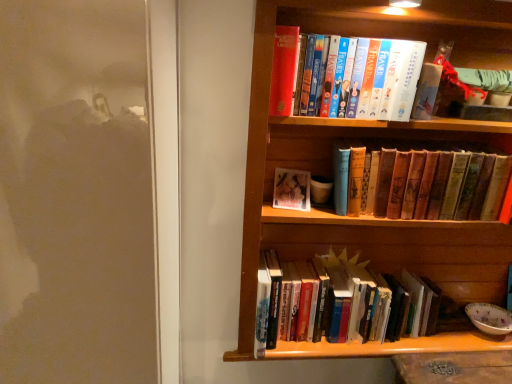
Locate an element on the screen. This screenshot has width=512, height=384. hardcover books at center, acting as the first book starting from the bottom is located at coordinates (350, 318).

In order to click on hardcover book at upper center, the 1th book in the top-to-bottom sequence in this screenshot , I will do `click(386, 78)`.

How many degrees apart are the facing directions of vintage leather book at center, positioned as the 2th book in bottom-to-top order, and hardcover books at center, which is counted as the third book, starting from the top?

The facing directions of vintage leather book at center, positioned as the 2th book in bottom-to-top order, and hardcover books at center, which is counted as the third book, starting from the top, are 0.00279 degrees apart.

Considering the sizes of objects vintage leather book at center, acting as the 2th book starting from the top, and hardcover books at center, which is counted as the third book, starting from the top, in the image provided, who is bigger, vintage leather book at center, acting as the 2th book starting from the top, or hardcover books at center, which is counted as the third book, starting from the top,?

With larger size is hardcover books at center, which is counted as the third book, starting from the top.

Is vintage leather book at center, positioned as the 2th book in bottom-to-top order, taller or shorter than hardcover books at center, which is counted as the third book, starting from the top?

Clearly, vintage leather book at center, positioned as the 2th book in bottom-to-top order, is shorter compared to hardcover books at center, which is counted as the third book, starting from the top.

Is hardcover books at center, which is counted as the third book, starting from the top, at the back of vintage leather book at center, positioned as the 2th book in bottom-to-top order?

No.

Would you say wooden bookcase at upper right is a long distance from hardcover book at upper center, the 1th book in the top-to-bottom sequence?

No, there isn't a large distance between wooden bookcase at upper right and hardcover book at upper center, the 1th book in the top-to-bottom sequence.

From the image's perspective, which is below, wooden bookcase at upper right or hardcover book at upper center, the 1th book in the top-to-bottom sequence?

wooden bookcase at upper right.

Is wooden bookcase at upper right in front of or behind hardcover book at upper center, the 1th book in the top-to-bottom sequence, in the image?

Clearly, wooden bookcase at upper right is in front of hardcover book at upper center, the 1th book in the top-to-bottom sequence.

Is point (466, 286) positioned behind point (345, 65)?

Yes, point (466, 286) is behind point (345, 65).

From a real-world perspective, who is located lower, wooden bookcase at upper right or hardcover books at center, acting as the first book starting from the bottom?

hardcover books at center, acting as the first book starting from the bottom, from a real-world perspective.

Between wooden bookcase at upper right and hardcover books at center, acting as the first book starting from the bottom, which one has larger size?

Bigger between the two is wooden bookcase at upper right.

Is wooden bookcase at upper right in front of hardcover books at center, which is counted as the third book, starting from the top?

Yes, wooden bookcase at upper right is closer to the viewer.

In the scene shown: Would you say wooden bookcase at upper right contains hardcover books at center, acting as the first book starting from the bottom?

Yes.

Are hardcover book at upper center, which is counted as the third book, starting from the bottom, and vintage leather book at center, positioned as the 2th book in bottom-to-top order, beside each other?

No.

Is hardcover book at upper center, which is counted as the third book, starting from the bottom, spatially inside vintage leather book at center, positioned as the 2th book in bottom-to-top order, or outside of it?

hardcover book at upper center, which is counted as the third book, starting from the bottom, cannot be found inside vintage leather book at center, positioned as the 2th book in bottom-to-top order.

Is hardcover book at upper center, the 1th book in the top-to-bottom sequence, in front of vintage leather book at center, positioned as the 2th book in bottom-to-top order?

Yes, it is.

Between hardcover book at upper center, which is counted as the third book, starting from the bottom, and vintage leather book at center, acting as the 2th book starting from the top, which one appears on the left side from the viewer's perspective?

Positioned to the left is hardcover book at upper center, which is counted as the third book, starting from the bottom.

From a real-world perspective, between hardcover book at upper center, which is counted as the third book, starting from the bottom, and wooden bookcase at upper right, who is vertically lower?

wooden bookcase at upper right is physically lower.

Does point (399, 55) lie in front of point (312, 121)?

Yes, it is in front of point (312, 121).

Considering the relative sizes of hardcover book at upper center, which is counted as the third book, starting from the bottom, and wooden bookcase at upper right in the image provided, is hardcover book at upper center, which is counted as the third book, starting from the bottom, smaller than wooden bookcase at upper right?

Correct, hardcover book at upper center, which is counted as the third book, starting from the bottom, occupies less space than wooden bookcase at upper right.

Considering the relative positions of hardcover book at upper center, which is counted as the third book, starting from the bottom, and wooden bookcase at upper right in the image provided, is hardcover book at upper center, which is counted as the third book, starting from the bottom, in front of wooden bookcase at upper right?

No.

Based on the photo, are hardcover books at center, acting as the first book starting from the bottom, and wooden bookcase at upper right beside each other?

No, hardcover books at center, acting as the first book starting from the bottom, is not beside wooden bookcase at upper right.

How many degrees apart are the facing directions of hardcover books at center, acting as the first book starting from the bottom, and wooden bookcase at upper right?

0.000686 degrees separate the facing orientations of hardcover books at center, acting as the first book starting from the bottom, and wooden bookcase at upper right.

Which of these two, hardcover books at center, which is counted as the third book, starting from the top, or wooden bookcase at upper right, stands shorter?

Standing shorter between the two is hardcover books at center, which is counted as the third book, starting from the top.

From a real-world perspective, relative to wooden bookcase at upper right, is hardcover books at center, which is counted as the third book, starting from the top, vertically above or below?

→ hardcover books at center, which is counted as the third book, starting from the top, is below wooden bookcase at upper right.

Is vintage leather book at center, positioned as the 2th book in bottom-to-top order, not near hardcover book at upper center, which is counted as the third book, starting from the bottom?

They are positioned close to each other.

From a real-world perspective, between vintage leather book at center, acting as the 2th book starting from the top, and hardcover book at upper center, the 1th book in the top-to-bottom sequence, who is vertically lower?

vintage leather book at center, acting as the 2th book starting from the top, from a real-world perspective.

From the image's perspective, which one is positioned lower, vintage leather book at center, acting as the 2th book starting from the top, or hardcover book at upper center, the 1th book in the top-to-bottom sequence?

From the image's view, vintage leather book at center, acting as the 2th book starting from the top, is below.

Can you confirm if vintage leather book at center, positioned as the 2th book in bottom-to-top order, is shorter than hardcover book at upper center, which is counted as the third book, starting from the bottom?

Yes.

Where is `book that is the 1st one above the hardcover books at center, which is counted as the third book, starting from the top (from a real-world perspective)`? This screenshot has width=512, height=384. book that is the 1st one above the hardcover books at center, which is counted as the third book, starting from the top (from a real-world perspective) is located at coordinates (421, 183).

This screenshot has height=384, width=512. What are the coordinates of `the 2nd book to the left of the wooden bookcase at upper right, counting from the anchor's position` in the screenshot? It's located at (386, 78).

Looking at the image, which one is located closer to hardcover book at upper center, which is counted as the third book, starting from the bottom, hardcover books at center, which is counted as the third book, starting from the top, or vintage leather book at center, positioned as the 2th book in bottom-to-top order?

The object closer to hardcover book at upper center, which is counted as the third book, starting from the bottom, is vintage leather book at center, positioned as the 2th book in bottom-to-top order.

Looking at the image, which one is located further to hardcover books at center, acting as the first book starting from the bottom, wooden bookcase at upper right or hardcover book at upper center, which is counted as the third book, starting from the bottom?

Based on the image, hardcover book at upper center, which is counted as the third book, starting from the bottom, appears to be further to hardcover books at center, acting as the first book starting from the bottom.

When comparing their distances from wooden bookcase at upper right, does vintage leather book at center, positioned as the 2th book in bottom-to-top order, or hardcover books at center, which is counted as the third book, starting from the top, seem further?

The object further to wooden bookcase at upper right is hardcover books at center, which is counted as the third book, starting from the top.

Looking at the image, which one is located further to vintage leather book at center, acting as the 2th book starting from the top, hardcover books at center, acting as the first book starting from the bottom, or wooden bookcase at upper right?

The object further to vintage leather book at center, acting as the 2th book starting from the top, is hardcover books at center, acting as the first book starting from the bottom.

From the picture: Estimate the real-world distances between objects in this image. Which object is further from hardcover book at upper center, which is counted as the third book, starting from the bottom, vintage leather book at center, positioned as the 2th book in bottom-to-top order, or wooden bookcase at upper right?

Based on the image, wooden bookcase at upper right appears to be further to hardcover book at upper center, which is counted as the third book, starting from the bottom.

Which object lies further to the anchor point hardcover books at center, acting as the first book starting from the bottom, hardcover book at upper center, the 1th book in the top-to-bottom sequence, or vintage leather book at center, acting as the 2th book starting from the top?

hardcover book at upper center, the 1th book in the top-to-bottom sequence, is positioned further to the anchor hardcover books at center, acting as the first book starting from the bottom.

From the image, which object appears to be nearer to wooden bookcase at upper right, hardcover books at center, which is counted as the third book, starting from the top, or vintage leather book at center, acting as the 2th book starting from the top?

vintage leather book at center, acting as the 2th book starting from the top.

Based on their spatial positions, is hardcover book at upper center, the 1th book in the top-to-bottom sequence, or vintage leather book at center, positioned as the 2th book in bottom-to-top order, closer to wooden bookcase at upper right?

Among the two, vintage leather book at center, positioned as the 2th book in bottom-to-top order, is located nearer to wooden bookcase at upper right.

This screenshot has height=384, width=512. Identify the location of book between hardcover book at upper center, the 1th book in the top-to-bottom sequence, and wooden bookcase at upper right vertically. (421, 183).

Image resolution: width=512 pixels, height=384 pixels. In order to click on book between hardcover book at upper center, which is counted as the third book, starting from the bottom, and hardcover books at center, acting as the first book starting from the bottom, in the vertical direction in this screenshot , I will do `click(421, 183)`.

The height and width of the screenshot is (384, 512). Identify the location of bookcase between vintage leather book at center, acting as the 2th book starting from the top, and hardcover books at center, acting as the first book starting from the bottom, in the up-down direction. (366, 136).

At what (x,y) coordinates should I click in order to perform the action: click on bookcase between hardcover book at upper center, which is counted as the third book, starting from the bottom, and hardcover books at center, which is counted as the third book, starting from the top, vertically. Please return your answer as a coordinate pair (x, y). Image resolution: width=512 pixels, height=384 pixels. Looking at the image, I should click on (366, 136).